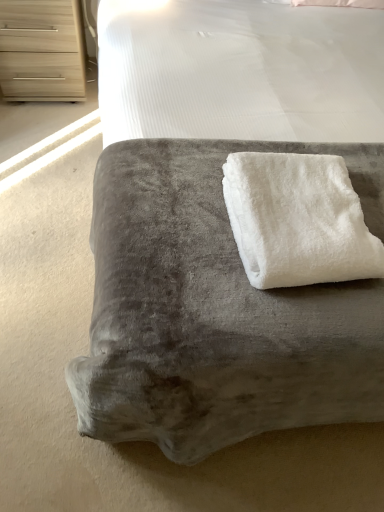
Question: From the image's perspective, is white fluffy towel at center beneath velvet gray ottoman at center?

Choices:
 (A) yes
 (B) no

Answer: (B)

Question: Does white fluffy towel at center turn towards velvet gray ottoman at center?

Choices:
 (A) yes
 (B) no

Answer: (B)

Question: Is the depth of white fluffy towel at center greater than that of velvet gray ottoman at center?

Choices:
 (A) no
 (B) yes

Answer: (B)

Question: Considering the relative sizes of white fluffy towel at center and velvet gray ottoman at center in the image provided, is white fluffy towel at center taller than velvet gray ottoman at center?

Choices:
 (A) no
 (B) yes

Answer: (A)

Question: Is white fluffy towel at center to the right of velvet gray ottoman at center from the viewer's perspective?

Choices:
 (A) no
 (B) yes

Answer: (B)

Question: Looking at their shapes, would you say light wood chest of drawers at upper left is wider or thinner than velvet gray ottoman at center?

Choices:
 (A) thin
 (B) wide

Answer: (A)

Question: From a real-world perspective, is light wood chest of drawers at upper left above or below velvet gray ottoman at center?

Choices:
 (A) above
 (B) below

Answer: (B)

Question: From the image's perspective, relative to velvet gray ottoman at center, is light wood chest of drawers at upper left above or below?

Choices:
 (A) below
 (B) above

Answer: (B)

Question: In the image, is light wood chest of drawers at upper left on the left side or the right side of velvet gray ottoman at center?

Choices:
 (A) right
 (B) left

Answer: (B)

Question: In the image, is white fluffy towel at center on the left side or the right side of velvet gray ottoman at center?

Choices:
 (A) left
 (B) right

Answer: (B)

Question: Looking at their shapes, would you say white fluffy towel at center is wider or thinner than velvet gray ottoman at center?

Choices:
 (A) wide
 (B) thin

Answer: (B)

Question: From a real-world perspective, is white fluffy towel at center above or below velvet gray ottoman at center?

Choices:
 (A) below
 (B) above

Answer: (B)

Question: From the image's perspective, relative to velvet gray ottoman at center, is white fluffy towel at center above or below?

Choices:
 (A) above
 (B) below

Answer: (A)

Question: Based on their sizes in the image, would you say white fluffy towel at center is bigger or smaller than light wood chest of drawers at upper left?

Choices:
 (A) small
 (B) big

Answer: (A)

Question: Considering the positions of point (306, 207) and point (39, 64), is point (306, 207) closer or farther from the camera than point (39, 64)?

Choices:
 (A) closer
 (B) farther

Answer: (A)